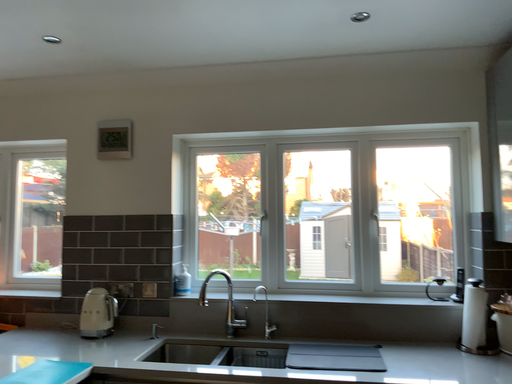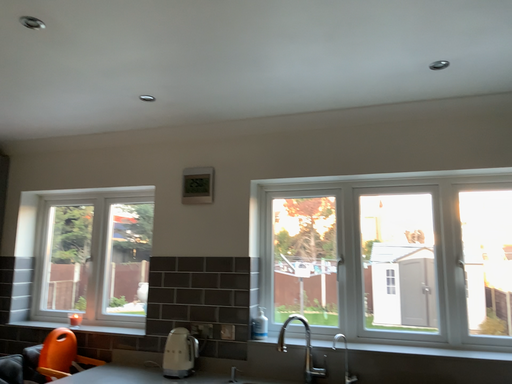
Question: Which way did the camera rotate in the video?

Choices:
 (A) rotated left
 (B) rotated right

Answer: (A)